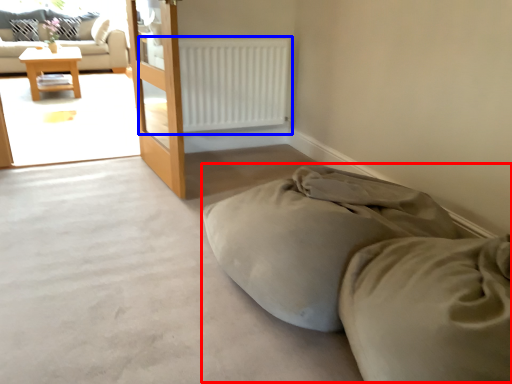
Question: Which object is further to the camera taking this photo, bed (highlighted by a red box) or radiator (highlighted by a blue box)?

Choices:
 (A) bed
 (B) radiator

Answer: (B)